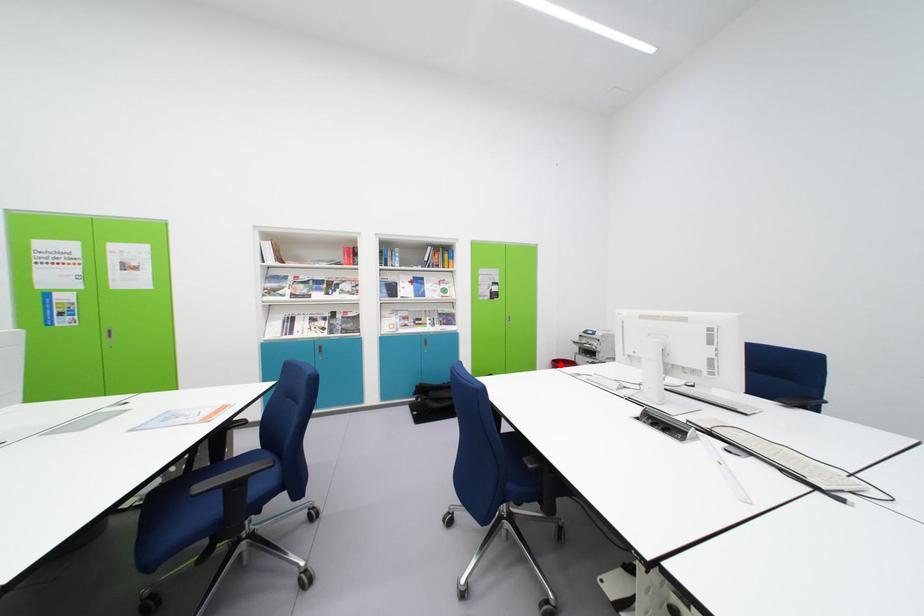
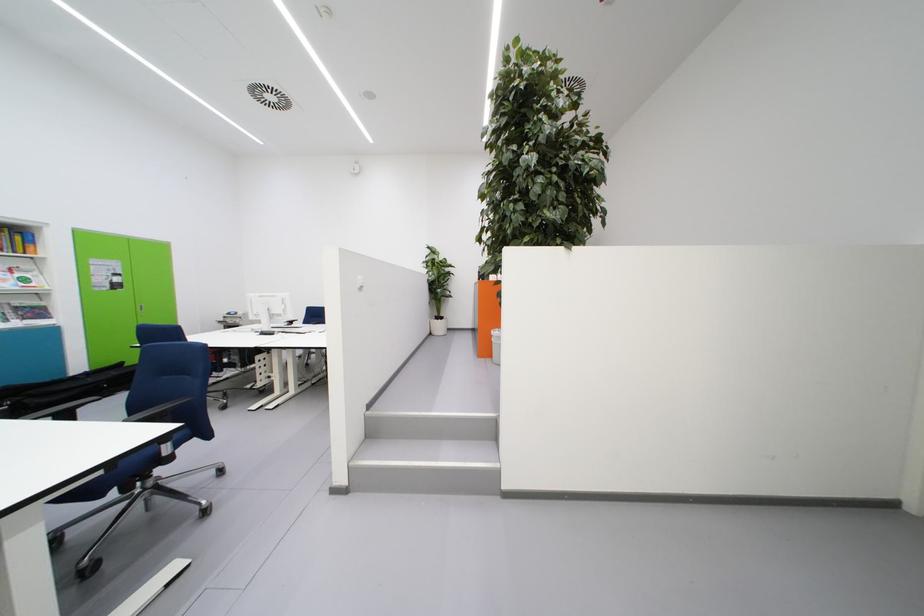
Question: I am providing you with two images of the same scene from different viewpoints. A red point is marked on the first image. Can you still see the location of the red point in image 2?

Choices:
 (A) Yes
 (B) No

Answer: (B)